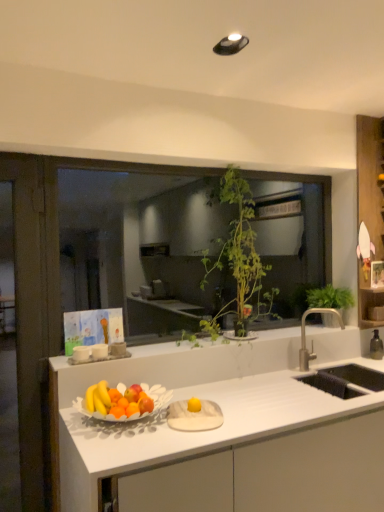
Question: Is green leafy plant at center, which is counted as the 2th houseplant, starting from the right, not near wooden shelf at right?

Choices:
 (A) yes
 (B) no

Answer: (B)

Question: Is green leafy plant at center, the first houseplant in the left-to-right sequence, with wooden shelf at right?

Choices:
 (A) no
 (B) yes

Answer: (A)

Question: From the image's perspective, is green leafy plant at center, the first houseplant in the left-to-right sequence, beneath wooden shelf at right?

Choices:
 (A) yes
 (B) no

Answer: (A)

Question: Can you confirm if green leafy plant at center, which is counted as the 2th houseplant, starting from the right, is bigger than wooden shelf at right?

Choices:
 (A) yes
 (B) no

Answer: (A)

Question: From a real-world perspective, is green leafy plant at center, which is counted as the 2th houseplant, starting from the right, located higher than wooden shelf at right?

Choices:
 (A) yes
 (B) no

Answer: (B)

Question: From a real-world perspective, is wooden shelf at right above or below green leafy plant at center, the first houseplant in the left-to-right sequence?

Choices:
 (A) below
 (B) above

Answer: (B)

Question: Is wooden shelf at right spatially inside green leafy plant at center, which is counted as the 2th houseplant, starting from the right, or outside of it?

Choices:
 (A) inside
 (B) outside

Answer: (B)

Question: Considering the positions of wooden shelf at right and green leafy plant at center, the first houseplant in the left-to-right sequence, in the image, is wooden shelf at right taller or shorter than green leafy plant at center, the first houseplant in the left-to-right sequence,?

Choices:
 (A) tall
 (B) short

Answer: (A)

Question: From the image's perspective, is wooden shelf at right positioned above or below green leafy plant at center, the first houseplant in the left-to-right sequence?

Choices:
 (A) above
 (B) below

Answer: (A)

Question: Is point (364, 314) positioned closer to the camera than point (96, 261)?

Choices:
 (A) closer
 (B) farther

Answer: (A)

Question: Is wooden shelf at right taller or shorter than green leafy plant at center?

Choices:
 (A) short
 (B) tall

Answer: (B)

Question: Which is correct: wooden shelf at right is inside green leafy plant at center, or outside of it?

Choices:
 (A) outside
 (B) inside

Answer: (A)

Question: Considering the relative positions of wooden shelf at right and green leafy plant at center in the image provided, is wooden shelf at right to the left or to the right of green leafy plant at center?

Choices:
 (A) left
 (B) right

Answer: (B)

Question: Choose the correct answer: Is white matte countertop at center inside wooden shelf at right or outside it?

Choices:
 (A) outside
 (B) inside

Answer: (A)

Question: Is white matte countertop at center bigger or smaller than wooden shelf at right?

Choices:
 (A) small
 (B) big

Answer: (B)